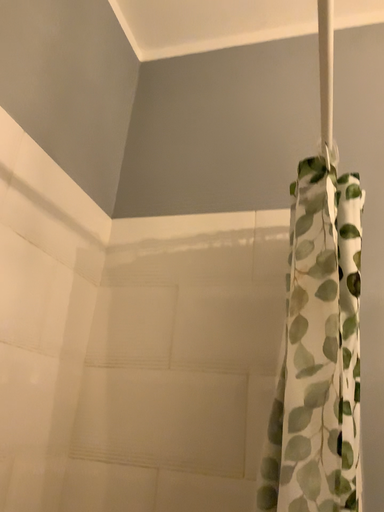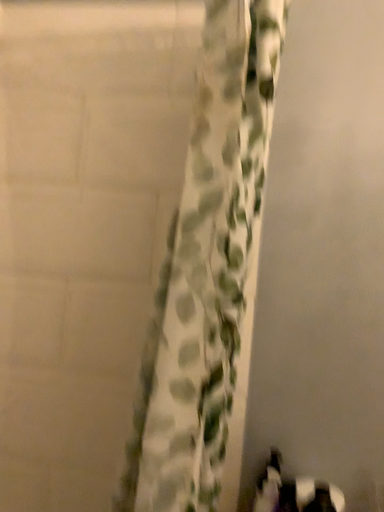
Question: Which way did the camera rotate in the video?

Choices:
 (A) rotated left
 (B) rotated right

Answer: (B)